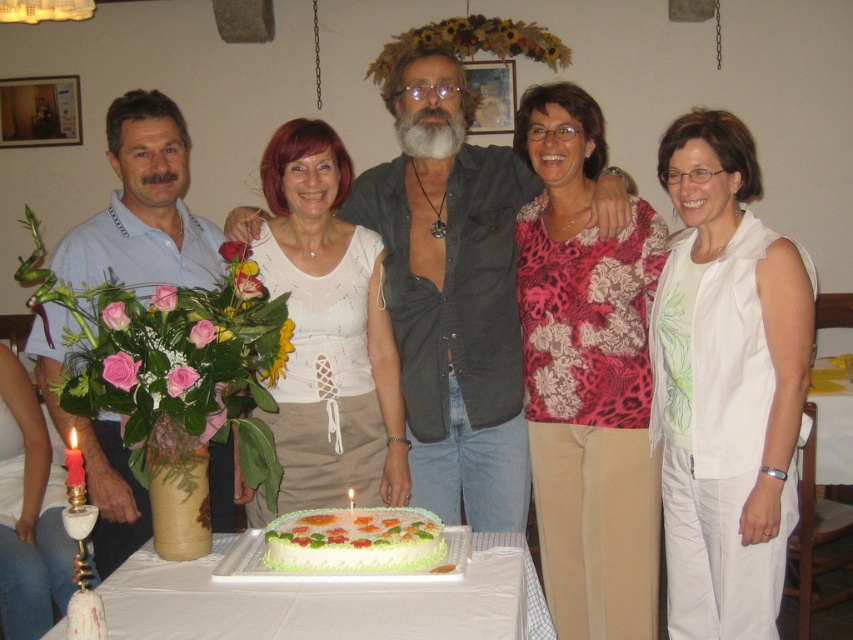
Can you confirm if floral print blouse at center is shorter than white cloth-covered table at center?

Incorrect, floral print blouse at center's height does not fall short of white cloth-covered table at center's.

Can you confirm if floral print blouse at center is bigger than white cloth-covered table at center?

Yes, floral print blouse at center is bigger than white cloth-covered table at center.

Image resolution: width=853 pixels, height=640 pixels. I want to click on floral print blouse at center, so click(587, 376).

Which is below, dark gray shirt at center or matte light blue polo shirt at left?

Positioned lower is matte light blue polo shirt at left.

Is dark gray shirt at center closer to the viewer compared to matte light blue polo shirt at left?

No, it is behind matte light blue polo shirt at left.

Who is more forward, (405, 300) or (114, 100)?

Point (114, 100) is in front.

Identify the location of dark gray shirt at center. The height and width of the screenshot is (640, 853). (451, 292).

Between matte light blue polo shirt at left and white cloth-covered table at center, which one has more height?

matte light blue polo shirt at left

Does matte light blue polo shirt at left lie behind white cloth-covered table at center?

Yes, it is.

Where is `matte light blue polo shirt at left`? This screenshot has width=853, height=640. matte light blue polo shirt at left is located at coordinates (143, 205).

Identify the location of matte light blue polo shirt at left. (143, 205).